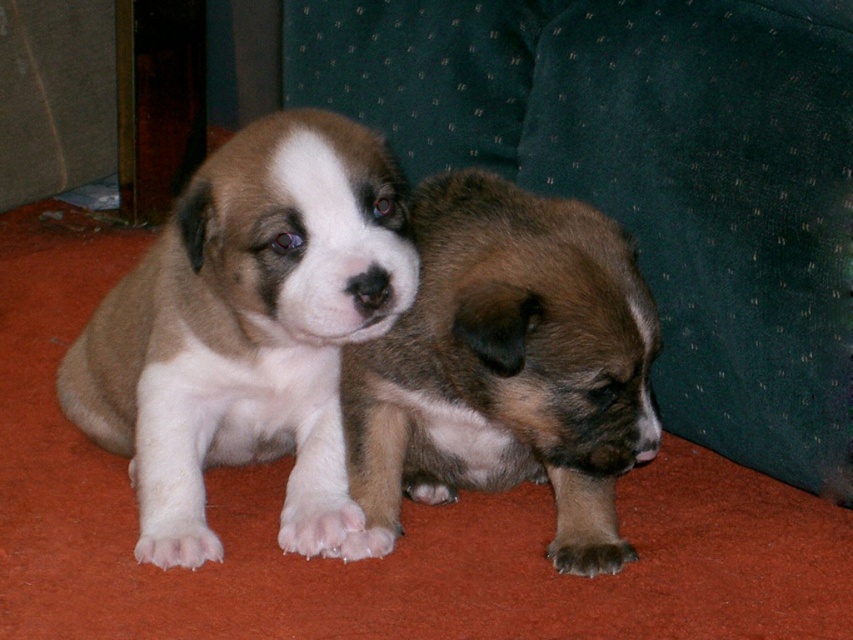
You are standing in the room and see the soft brown fur puppy at center. If you want to walk directly towards it from your current position, which direction should you move in relation to the room?

To walk directly towards the soft brown fur puppy at center located at point 2D coordinates (x=247, y=330), you should move forward since the puppy is positioned in the central area of the room.

You are a dog trainer observing two puppies on a red carpet. The puppies are the soft brown fur puppy at center and another puppy. You need to determine if they can both fit in a training pen that is 4 feet wide. Can they fit comfortably without overlapping?

The two puppies are 3.92 feet apart, so they can fit comfortably in the 4 feet wide pen without overlapping.

You are a photographer setting up a shoot with two puppies. The scene has a soft brown fur puppy at center and a brown fuzzy puppy at center. If you want to capture both puppies in a single frame without moving them, which puppy should you focus on first to ensure both are in focus?

The soft brown fur puppy at center is located above the brown fuzzy puppy at center, so focusing on the soft brown fur puppy at center first will help ensure both are in focus as they are stacked vertically.